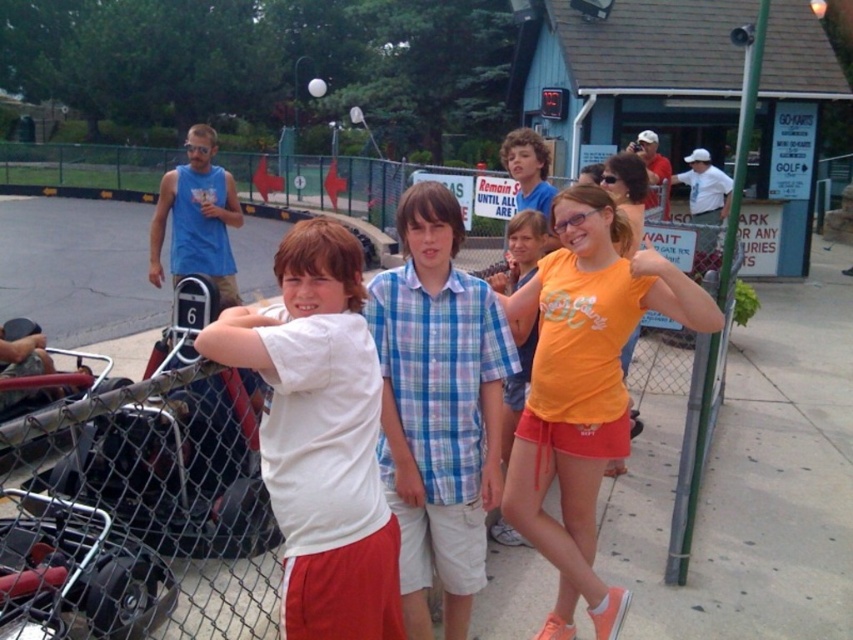
Does white matte shirt at center have a greater width compared to blue plaid shirt at center?

No.

What do you see at coordinates (320, 436) in the screenshot?
I see `white matte shirt at center` at bounding box center [320, 436].

Is point (279, 317) farther from camera compared to point (422, 628)?

That is False.

Image resolution: width=853 pixels, height=640 pixels. I want to click on white matte shirt at center, so click(320, 436).

In the scene shown: Can you confirm if white matte shirt at center is wider than orange matte t-shirt at center?

No.

Which is behind, point (202, 348) or point (682, 292)?

Point (682, 292)

Where is `white matte shirt at center`? The height and width of the screenshot is (640, 853). white matte shirt at center is located at coordinates (320, 436).

Can you confirm if blue plaid shirt at center is positioned to the left of orange matte t-shirt at center?

Correct, you'll find blue plaid shirt at center to the left of orange matte t-shirt at center.

Is blue plaid shirt at center thinner than orange matte t-shirt at center?

Indeed, blue plaid shirt at center has a lesser width compared to orange matte t-shirt at center.

Locate an element on the screen. blue plaid shirt at center is located at coordinates (438, 406).